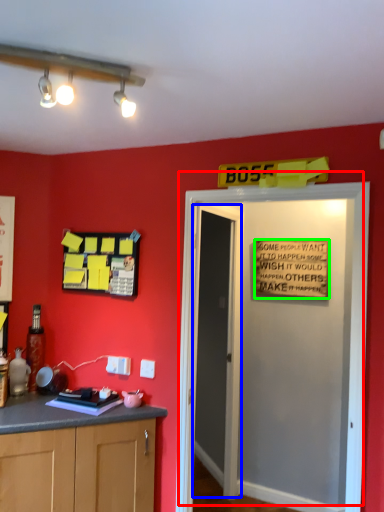
Question: Considering the real-world distances, which object is farthest from door (highlighted by a red box)? door (highlighted by a blue box) or warning sign (highlighted by a green box)?

Choices:
 (A) door
 (B) warning sign

Answer: (A)